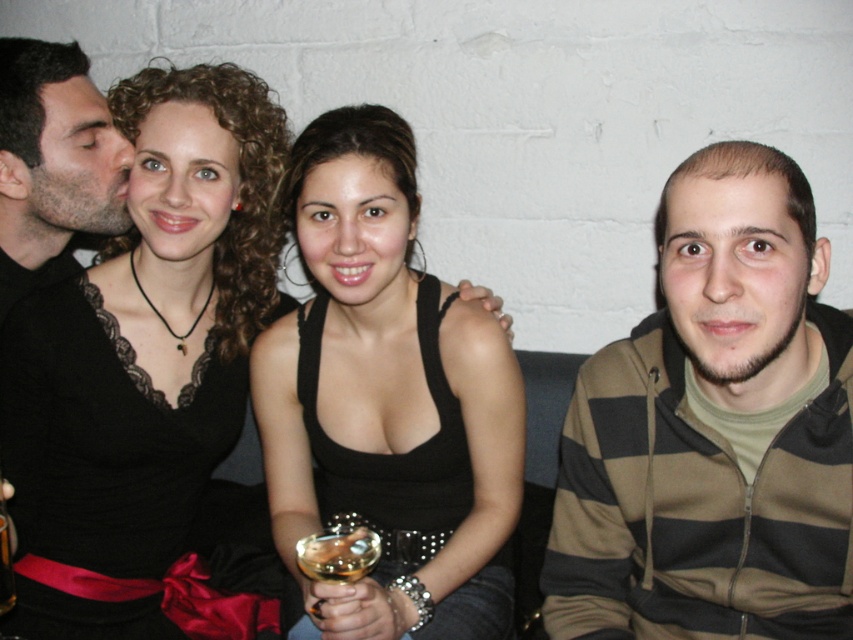
Question: Estimate the real-world distances between objects in this image. Which object is closer to the translucent glass wine glass at center?

Choices:
 (A) black matte shirt at left
 (B) black lace dress at upper left
 (C) translucent glass wine at center
 (D) striped hoodie at right

Answer: (C)

Question: Does black matte tank top at center have a lesser width compared to matte black shirt at left?

Choices:
 (A) no
 (B) yes

Answer: (A)

Question: Does striped hoodie at right lie in front of black matte shirt at left?

Choices:
 (A) yes
 (B) no

Answer: (A)

Question: Which point appears closest to the camera in this image?

Choices:
 (A) (306, 547)
 (B) (384, 589)

Answer: (A)

Question: Which point is farther from the camera taking this photo?

Choices:
 (A) (328, 548)
 (B) (103, 512)
 (C) (3, 509)

Answer: (B)

Question: Is the position of striped hoodie at right less distant than that of matte black shirt at left?

Choices:
 (A) yes
 (B) no

Answer: (A)